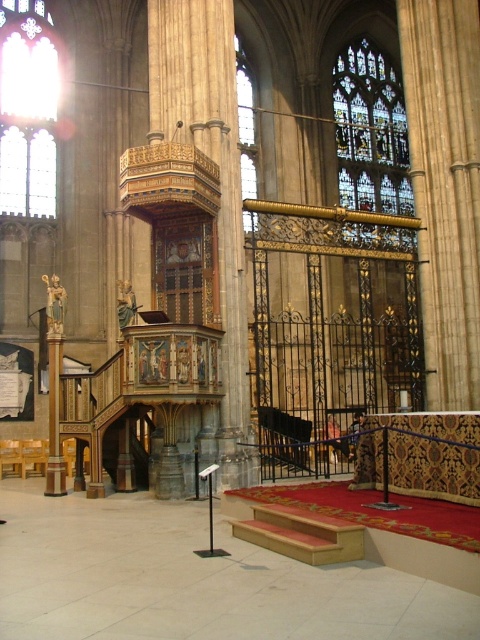
Question: Is clear stained glass at upper left to the right of stained glass at upper center from the viewer's perspective?

Choices:
 (A) no
 (B) yes

Answer: (A)

Question: Estimate the real-world distances between objects in this image. Which object is farther from the clear stained glass at upper left?

Choices:
 (A) clear stained glass at upper center
 (B) stained glass at upper center

Answer: (B)

Question: Can you confirm if clear stained glass at upper left is bigger than clear stained glass at upper center?

Choices:
 (A) yes
 (B) no

Answer: (B)

Question: Which of the following is the closest to the observer?

Choices:
 (A) (380, 122)
 (B) (247, 68)

Answer: (B)

Question: Which object is farther from the camera taking this photo?

Choices:
 (A) stained glass at upper center
 (B) clear stained glass at upper center
 (C) clear stained glass at upper left

Answer: (C)

Question: Considering the relative positions of clear stained glass at upper left and clear stained glass at upper center in the image provided, where is clear stained glass at upper left located with respect to clear stained glass at upper center?

Choices:
 (A) right
 (B) left

Answer: (B)